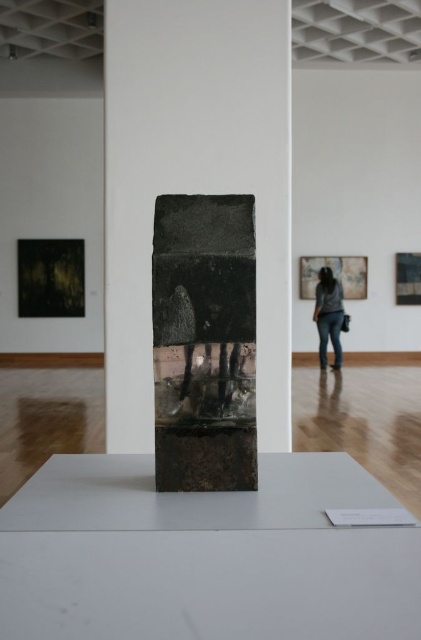
Question: Can you confirm if black stone sculpture at center is smaller than denim jeans at center?

Choices:
 (A) yes
 (B) no

Answer: (A)

Question: Is black stone sculpture at center wider than denim jeans at center?

Choices:
 (A) no
 (B) yes

Answer: (A)

Question: Is black stone sculpture at center behind denim jeans at center?

Choices:
 (A) no
 (B) yes

Answer: (A)

Question: Among these points, which one is farthest from the camera?

Choices:
 (A) (218, 324)
 (B) (317, 300)

Answer: (B)